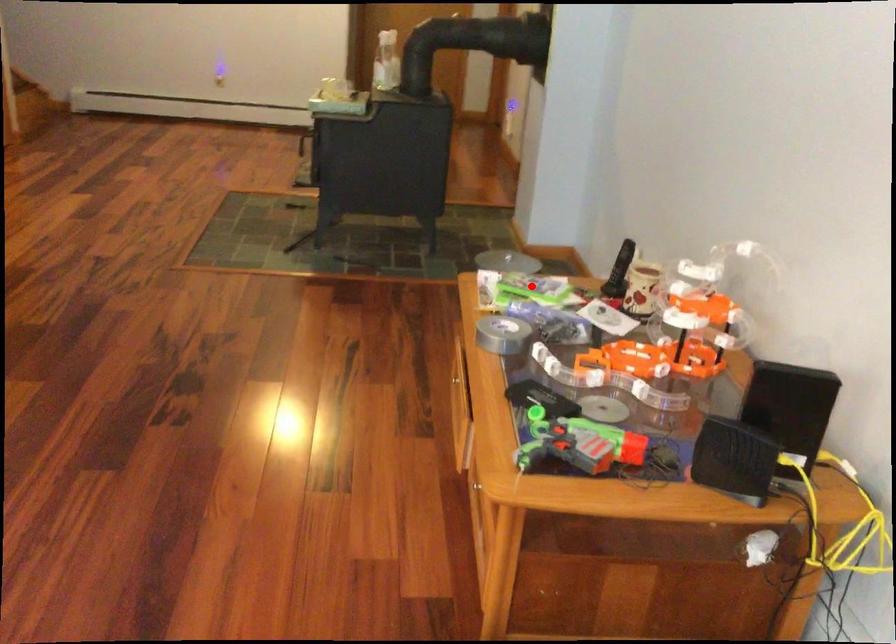
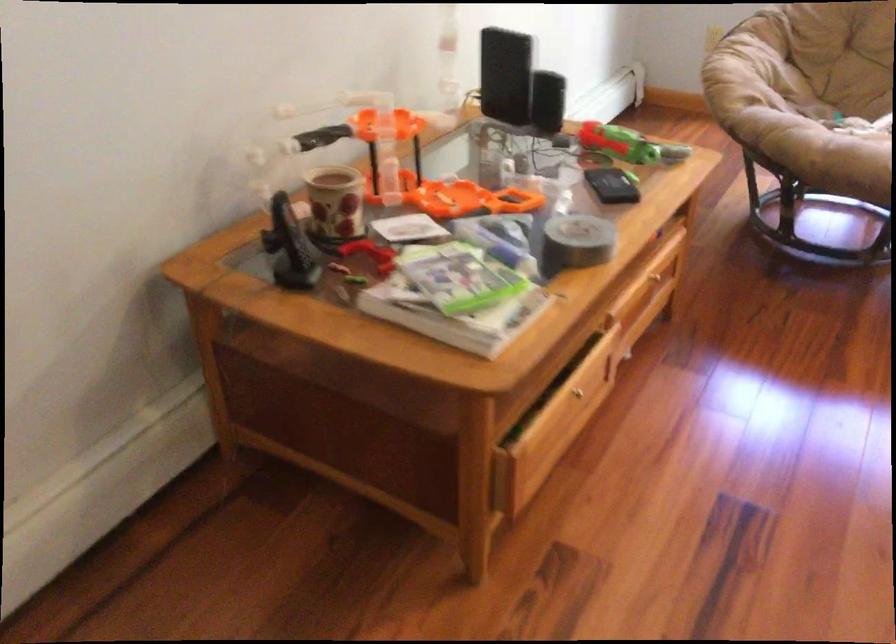
Question: I am providing you with two images of the same scene from different viewpoints. A red point is marked on the first image. At the location where the point appears in image 1, is it still visible in image 2?

Choices:
 (A) Yes
 (B) No

Answer: (A)